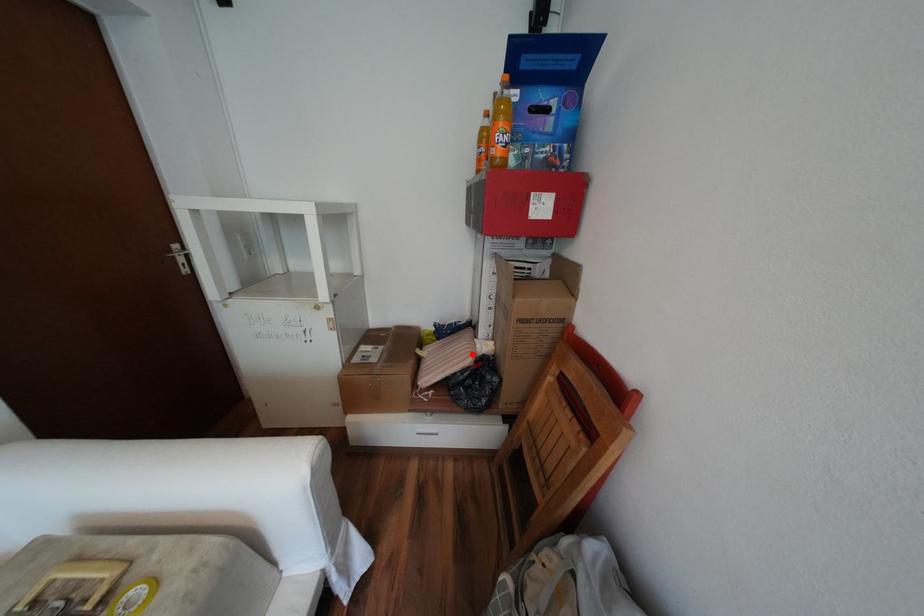
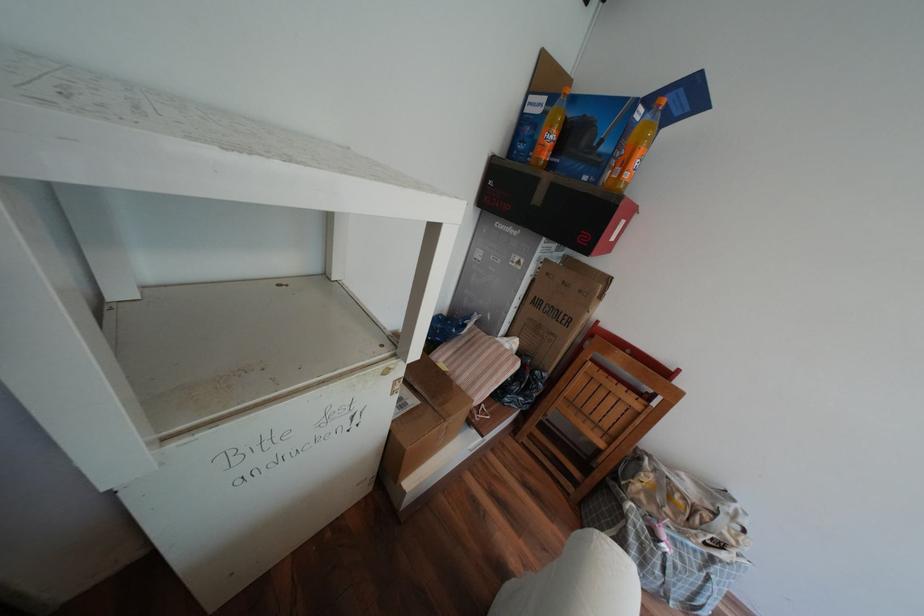
In the second image, find the point that corresponds to the highlighted location in the first image.

(517, 360)